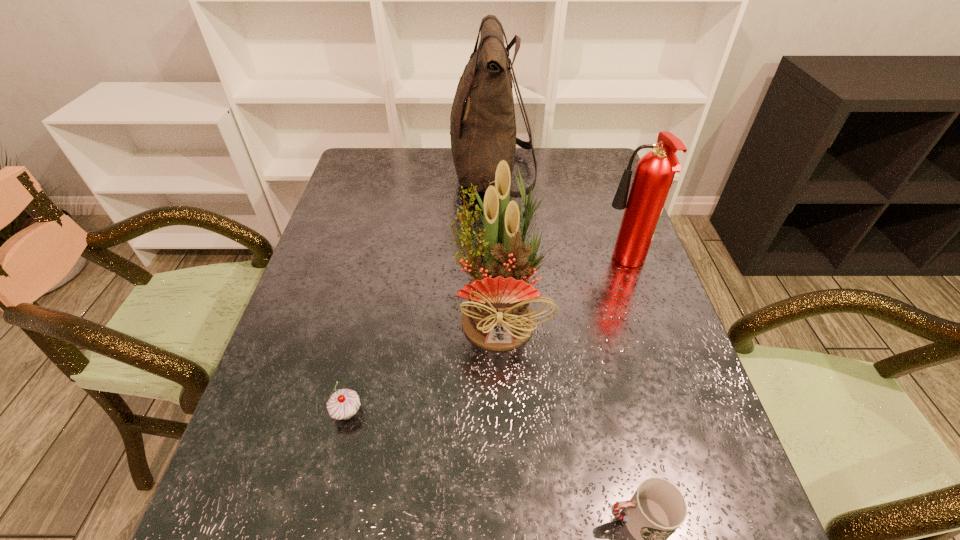
You are a GUI agent. You are given a task and a screenshot of the screen. Output one action in this format:
    pyautogui.click(x=<x>, y=<y>)
    Task: Click on the blank space at the far left corner
    
    Given the screenshot: What is the action you would take?
    pyautogui.click(x=362, y=175)

I want to click on free space that is in between the backpack and the fire extinguisher, so click(x=559, y=220).

Locate an element on the screen. empty space between the rightmost object and the flower arrangement is located at coordinates (563, 289).

The height and width of the screenshot is (540, 960). Identify the location of free space that is in between the rightmost object and the backpack. (559, 220).

You are a GUI agent. You are given a task and a screenshot of the screen. Output one action in this format:
    pyautogui.click(x=<x>, y=<y>)
    Task: Click on the free space between the farthest object and the cupcake
    Image resolution: width=960 pixels, height=540 pixels.
    Given the screenshot: What is the action you would take?
    pyautogui.click(x=420, y=294)

Locate an element on the screen. unoccupied position between the tallest object and the rightmost object is located at coordinates (559, 220).

At what (x,y) coordinates should I click in order to perform the action: click on vacant space in between the tallest object and the rightmost object. Please return your answer as a coordinate pair (x, y). The height and width of the screenshot is (540, 960). Looking at the image, I should click on (559, 220).

Identify which object is the third nearest to the cupcake. Please provide its 2D coordinates. Your answer should be formatted as a tuple, i.e. [(x, y)], where the tuple contains the x and y coordinates of a point satisfying the conditions above.

[(655, 171)]

Find the location of a particular element. object that is the fourth nearest to the backpack is located at coordinates (656, 510).